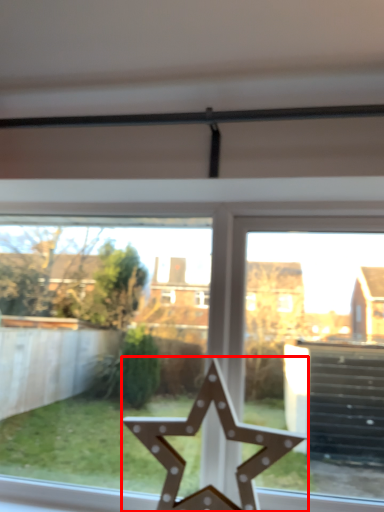
Question: Observing the image, what is the correct spatial positioning of star (annotated by the red box) in reference to window?

Choices:
 (A) left
 (B) right

Answer: (B)